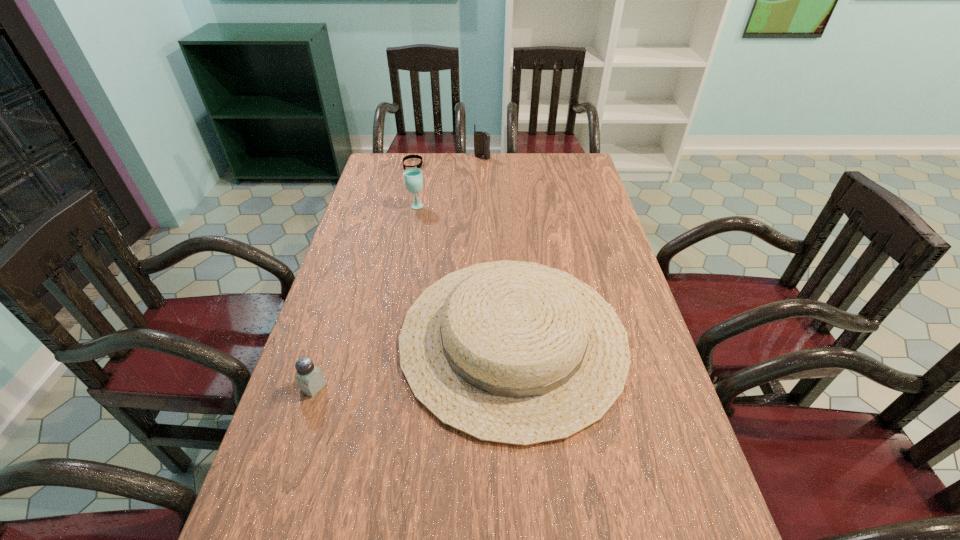
The height and width of the screenshot is (540, 960). In the image, there is a desktop. Identify the location of vacant space at the far left corner. (375, 158).

At what (x,y) coordinates should I click in order to perform the action: click on vacant point at the far right corner. Please return your answer as a coordinate pair (x, y). The image size is (960, 540). Looking at the image, I should click on (559, 180).

Where is `empty space that is in between the shortest object and the cellular telephone`? empty space that is in between the shortest object and the cellular telephone is located at coordinates (447, 161).

This screenshot has width=960, height=540. I want to click on vacant space that's between the shortest object and the sunhat, so click(463, 252).

At what (x,y) coordinates should I click in order to perform the action: click on vacant space that is in between the wristband and the cellular telephone. Please return your answer as a coordinate pair (x, y). Looking at the image, I should click on (447, 161).

Find the location of a particular element. free space between the third shortest object and the cellular telephone is located at coordinates (497, 248).

Where is `vacant area that lies between the cellular telephone and the third nearest object`? The height and width of the screenshot is (540, 960). vacant area that lies between the cellular telephone and the third nearest object is located at coordinates (449, 181).

Where is `free point between the cellular telephone and the shortest object`? Image resolution: width=960 pixels, height=540 pixels. free point between the cellular telephone and the shortest object is located at coordinates (447, 161).

Image resolution: width=960 pixels, height=540 pixels. What are the coordinates of `unoccupied area between the cellular telephone and the wristband` in the screenshot? It's located at (447, 161).

The image size is (960, 540). What are the coordinates of `free space that is in between the leftmost object and the cellular telephone` in the screenshot? It's located at (397, 272).